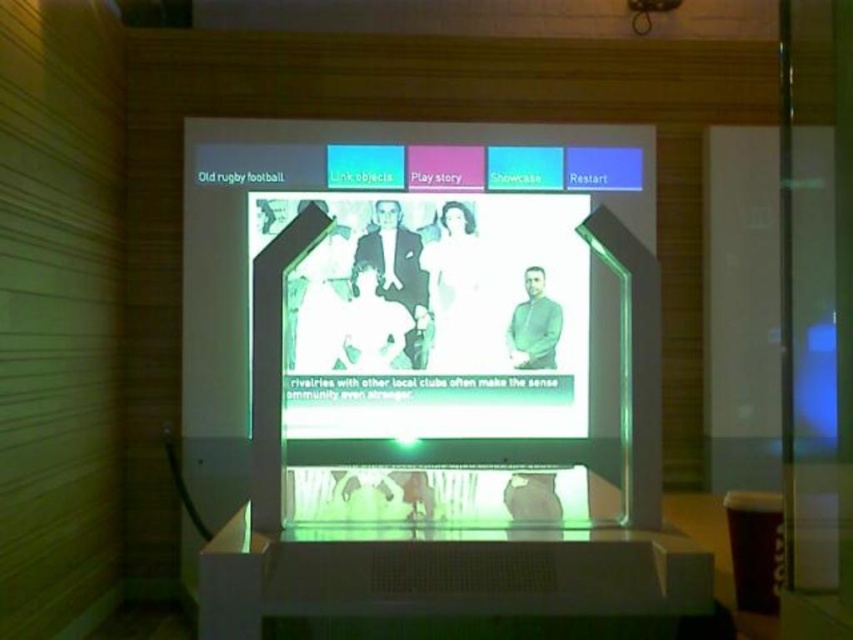
Between translucent plastic screen at center and transparent plastic projector at center, which one is positioned lower?

Positioned lower is translucent plastic screen at center.

Is translucent plastic screen at center closer to camera compared to transparent plastic projector at center?

That is True.

Who is more distant from viewer, (463, 493) or (640, 1)?

Positioned behind is point (640, 1).

Where is `translucent plastic screen at center`? translucent plastic screen at center is located at coordinates (444, 368).